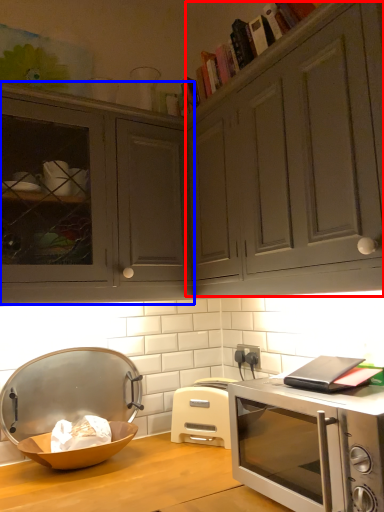
Question: Which object is closer to the camera taking this photo, drawer (highlighted by a red box) or cabinetry (highlighted by a blue box)?

Choices:
 (A) drawer
 (B) cabinetry

Answer: (A)